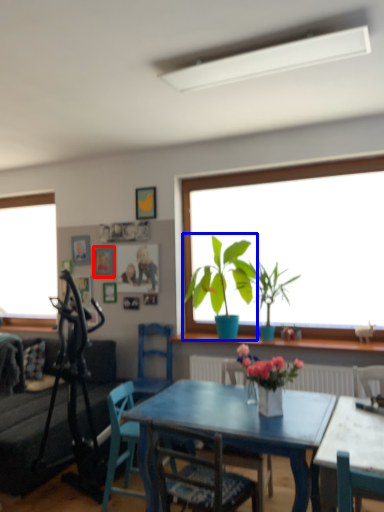
Question: Which point is further to the camera, picture frame (highlighted by a red box) or houseplant (highlighted by a blue box)?

Choices:
 (A) picture frame
 (B) houseplant

Answer: (A)